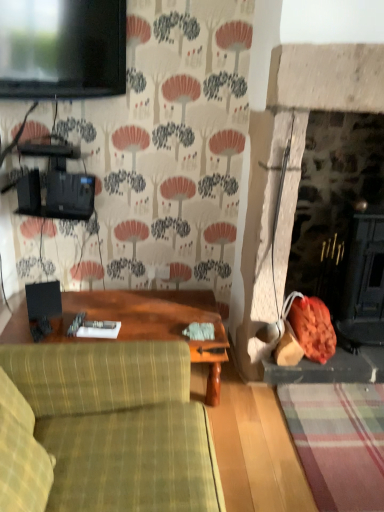
Question: Considering the positions of wooden table at center and matte black tv at upper left in the image, is wooden table at center bigger or smaller than matte black tv at upper left?

Choices:
 (A) small
 (B) big

Answer: (B)

Question: Choose the correct answer: Is wooden table at center inside matte black tv at upper left or outside it?

Choices:
 (A) inside
 (B) outside

Answer: (B)

Question: Considering the real-world distances, which object is farthest from the green plaid fabric couch at lower left?

Choices:
 (A) wooden table at center
 (B) matte black tv at upper left

Answer: (B)

Question: Which is nearer to the matte black tv at upper left?

Choices:
 (A) green plaid fabric couch at lower left
 (B) wooden table at center

Answer: (B)